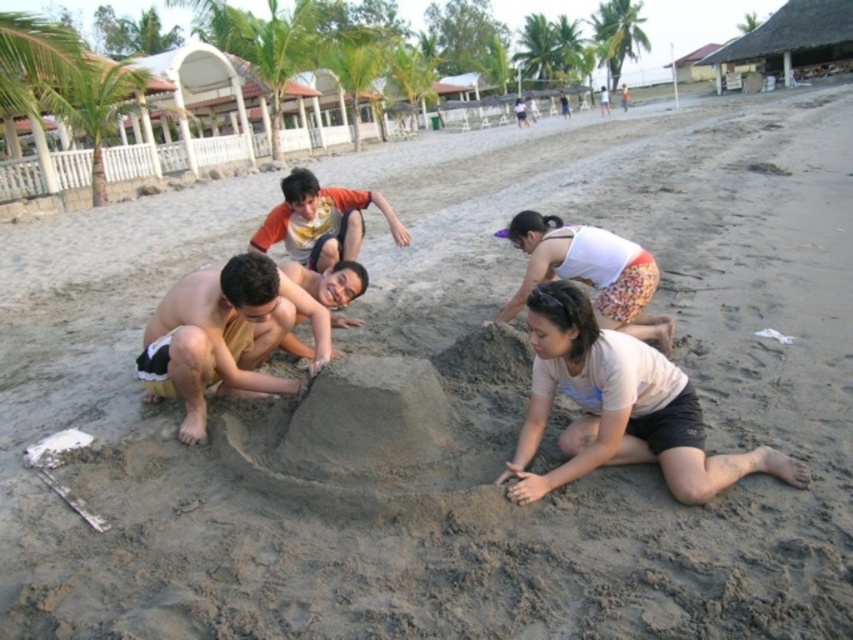
Can you confirm if light beige cotton shirt at lower right is positioned below tan skin man at center?

Correct, light beige cotton shirt at lower right is located below tan skin man at center.

Between light beige cotton shirt at lower right and tan skin man at center, which one has less height?

Standing shorter between the two is light beige cotton shirt at lower right.

Where is `light beige cotton shirt at lower right`? light beige cotton shirt at lower right is located at coordinates (619, 408).

Based on the photo, between tan skin man at center and white cotton tank top at lower center, which one is positioned higher?

white cotton tank top at lower center is higher up.

Is tan skin man at center below white cotton tank top at lower center?

Yes, tan skin man at center is below white cotton tank top at lower center.

Where is `tan skin man at center`? The height and width of the screenshot is (640, 853). tan skin man at center is located at coordinates (224, 337).

Find the location of `tan skin man at center`. tan skin man at center is located at coordinates (224, 337).

Can you confirm if light beige cotton shirt at lower right is taller than white cotton tank top at lower center?

In fact, light beige cotton shirt at lower right may be shorter than white cotton tank top at lower center.

Is point (605, 445) positioned behind point (519, 298)?

No, (605, 445) is closer to viewer.

The width and height of the screenshot is (853, 640). In order to click on light beige cotton shirt at lower right in this screenshot , I will do 619,408.

The width and height of the screenshot is (853, 640). Find the location of `light beige cotton shirt at lower right`. light beige cotton shirt at lower right is located at coordinates (619, 408).